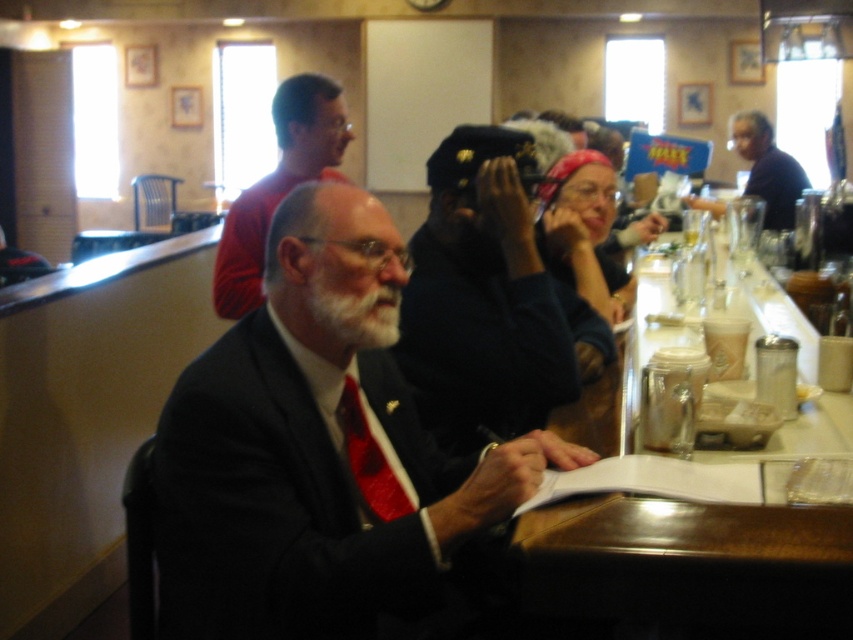
Measure the distance between dark blue uniform at center and white matte beard at center.

17.73 inches

Does point (506, 381) come in front of point (347, 346)?

No, it is not.

Which is in front, point (451, 390) or point (392, 284)?

Point (392, 284) is in front.

Image resolution: width=853 pixels, height=640 pixels. Find the location of `dark blue uniform at center`. dark blue uniform at center is located at coordinates click(489, 300).

Between matte black suit at center and matte red shirt at upper left, which one has more height?

With more height is matte black suit at center.

Does matte black suit at center have a greater width compared to matte red shirt at upper left?

Correct, the width of matte black suit at center exceeds that of matte red shirt at upper left.

Is point (354, 602) closer to camera compared to point (334, 134)?

Yes.

Where is `matte black suit at center`? Image resolution: width=853 pixels, height=640 pixels. matte black suit at center is located at coordinates (318, 464).

Is matte red shirt at upper left thinner than white matte beard at center?

No.

Is point (227, 317) positioned in front of point (351, 346)?

No, it is behind (351, 346).

Locate an element on the screen. The height and width of the screenshot is (640, 853). matte red shirt at upper left is located at coordinates (279, 184).